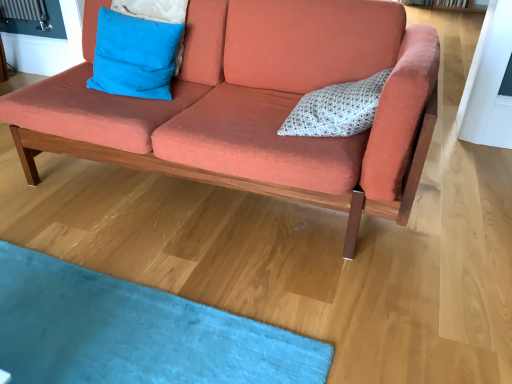
Question: Would you say white dotted fabric pillow at center, which ranks as the 1th pillow in right-to-left order, is inside or outside blue suede pillow at upper left, which ranks as the second pillow in right-to-left order?

Choices:
 (A) outside
 (B) inside

Answer: (A)

Question: From the image's perspective, is white dotted fabric pillow at center, which ranks as the 1th pillow in right-to-left order, positioned above or below blue suede pillow at upper left, which ranks as the second pillow in right-to-left order?

Choices:
 (A) below
 (B) above

Answer: (A)

Question: Considering the real-world distances, which object is closest to the white dotted fabric pillow at center, acting as the 2th pillow starting from the left?

Choices:
 (A) blue suede pillow at upper left, which ranks as the second pillow in right-to-left order
 (B) coral fabric couch at center

Answer: (B)

Question: Considering the real-world distances, which object is closest to the coral fabric couch at center?

Choices:
 (A) blue suede pillow at upper left, the 1th pillow from the left
 (B) white dotted fabric pillow at center, which ranks as the 1th pillow in right-to-left order

Answer: (B)